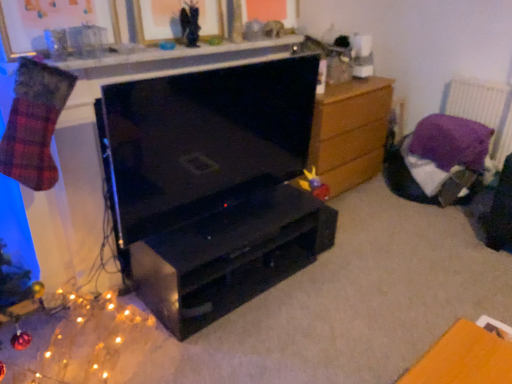
You are a GUI agent. You are given a task and a screenshot of the screen. Output one action in this format:
    pyautogui.click(x=<x>, y=<y>)
    Task: Click on the vacant space in front of black matte desk at center
    Image resolution: width=512 pixels, height=384 pixels.
    Given the screenshot: What is the action you would take?
    pyautogui.click(x=228, y=344)